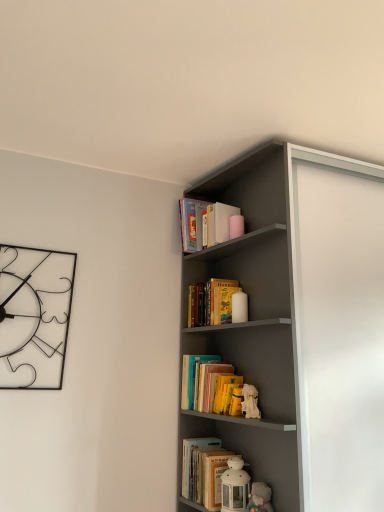
What is the approximate height of matte gray bookshelf at upper right?

Answer: matte gray bookshelf at upper right is 5.50 feet in height.

The width and height of the screenshot is (384, 512). Identify the location of matte gray bookshelf at upper right. 300,325.

Describe the element at coordinates (204, 472) in the screenshot. The height and width of the screenshot is (512, 384). I see `hardcover book at center, arranged as the third book when viewed from the top` at that location.

Where is `white matte lantern at lower center, the second toy when ordered from top to bottom`? Image resolution: width=384 pixels, height=512 pixels. white matte lantern at lower center, the second toy when ordered from top to bottom is located at coordinates (235, 486).

This screenshot has height=512, width=384. Identify the location of white plush toy at middle, which is the 1th toy from top to bottom. (250, 402).

At what (x,y) coordinates should I click in order to perform the action: click on hardcover book at upper center, the 3th book from the bottom. Please return your answer as a coordinate pair (x, y). The height and width of the screenshot is (512, 384). Looking at the image, I should click on (206, 224).

The image size is (384, 512). I want to click on wireframe metal clock at left, so click(x=34, y=316).

From the image's perspective, is yellow paper book at upper center, acting as the 2th book starting from the back, located above or below hardcover book at center, which is the first book in front-to-back order?

Based on their image positions, yellow paper book at upper center, acting as the 2th book starting from the back, is located above hardcover book at center, which is the first book in front-to-back order.

Does yellow paper book at upper center, the 2th book positioned from the front, touch hardcover book at center, the third book positioned from the back?

No, yellow paper book at upper center, the 2th book positioned from the front, is not in contact with hardcover book at center, the third book positioned from the back.

In the scene shown: What's the angular difference between yellow paper book at upper center, acting as the 2th book starting from the back, and hardcover book at center, arranged as the third book when viewed from the top,'s facing directions?

4.68 degrees.

Is yellow paper book at upper center, the 2th book when ordered from top to bottom, oriented towards hardcover book at center, arranged as the third book when viewed from the top?

No, yellow paper book at upper center, the 2th book when ordered from top to bottom, does not turn towards hardcover book at center, arranged as the third book when viewed from the top.

Considering the sizes of wireframe metal clock at left and hardcover book at upper center, marked as the third book in a front-to-back arrangement, in the image, is wireframe metal clock at left bigger or smaller than hardcover book at upper center, marked as the third book in a front-to-back arrangement,?

Clearly, wireframe metal clock at left is larger in size than hardcover book at upper center, marked as the third book in a front-to-back arrangement.

Is wireframe metal clock at left oriented towards hardcover book at upper center, marked as the third book in a front-to-back arrangement?

No.

Are wireframe metal clock at left and hardcover book at upper center, the 3th book from the bottom, located far from each other?

No, wireframe metal clock at left is not far from hardcover book at upper center, the 3th book from the bottom.

Is matte gray bookshelf at upper right closer to the viewer compared to hardcover book at center, arranged as the third book when viewed from the top?

Yes, matte gray bookshelf at upper right is closer to the viewer.

Is matte gray bookshelf at upper right in contact with hardcover book at center, arranged as the third book when viewed from the top?

They are not placed beside each other.

Is hardcover book at center, which is the first book in front-to-back order, surrounded by matte gray bookshelf at upper right?

No, matte gray bookshelf at upper right does not contain hardcover book at center, which is the first book in front-to-back order.

From a real-world perspective, is matte gray bookshelf at upper right positioned under hardcover book at center, which is the first book in front-to-back order, based on gravity?

No, from a real-world perspective, matte gray bookshelf at upper right is not below hardcover book at center, which is the first book in front-to-back order.

The image size is (384, 512). Find the location of `the 1st book behind the wireframe metal clock at left, counting from the anchor's position`. the 1st book behind the wireframe metal clock at left, counting from the anchor's position is located at coordinates [x=210, y=302].

Relative to yellow paper book at upper center, the 2th book when ordered from top to bottom, is wireframe metal clock at left in front or behind?

In the image, wireframe metal clock at left appears in front of yellow paper book at upper center, the 2th book when ordered from top to bottom.

Between point (23, 297) and point (223, 321), which one is positioned behind?

Positioned behind is point (223, 321).

Can you tell me how much white plush toy at middle, which is the 1th toy from top to bottom, and matte gray bookshelf at upper right differ in facing direction?

83.8 degrees separate the facing orientations of white plush toy at middle, which is the 1th toy from top to bottom, and matte gray bookshelf at upper right.

Is white plush toy at middle, arranged as the 2th toy when ordered from the bottom, wider or thinner than matte gray bookshelf at upper right?

Clearly, white plush toy at middle, arranged as the 2th toy when ordered from the bottom, has less width compared to matte gray bookshelf at upper right.

Can you confirm if white plush toy at middle, which is the 1th toy from top to bottom, is taller than matte gray bookshelf at upper right?

No, white plush toy at middle, which is the 1th toy from top to bottom, is not taller than matte gray bookshelf at upper right.

Is white plush toy at middle, which is the 1th toy from top to bottom, to the left or to the right of matte gray bookshelf at upper right in the image?

Based on their positions, white plush toy at middle, which is the 1th toy from top to bottom, is located to the left of matte gray bookshelf at upper right.

From a real-world perspective, is white plush toy at middle, arranged as the 2th toy when ordered from the bottom, below hardcover book at center, the 1th book in the bottom-to-top sequence?

No, from a real-world perspective, white plush toy at middle, arranged as the 2th toy when ordered from the bottom, is not beneath hardcover book at center, the 1th book in the bottom-to-top sequence.

Can we say white plush toy at middle, which is the 1th toy from top to bottom, lies outside hardcover book at center, the 1th book in the bottom-to-top sequence?

Yes, white plush toy at middle, which is the 1th toy from top to bottom, is not within hardcover book at center, the 1th book in the bottom-to-top sequence.

Would you say white plush toy at middle, which is the 1th toy from top to bottom, is to the left or to the right of hardcover book at center, the third book positioned from the back, in the picture?

white plush toy at middle, which is the 1th toy from top to bottom, is to the right of hardcover book at center, the third book positioned from the back.

Is yellow paper book at upper center, which is counted as the 2th book, starting from the bottom, positioned with its back to matte gray bookshelf at upper right?

Yes, yellow paper book at upper center, which is counted as the 2th book, starting from the bottom, is facing away from matte gray bookshelf at upper right.

How far apart are yellow paper book at upper center, the 2th book when ordered from top to bottom, and matte gray bookshelf at upper right?

yellow paper book at upper center, the 2th book when ordered from top to bottom, and matte gray bookshelf at upper right are 14.67 inches apart.

Choose the correct answer: Is yellow paper book at upper center, which is counted as the 2th book, starting from the bottom, inside matte gray bookshelf at upper right or outside it?

yellow paper book at upper center, which is counted as the 2th book, starting from the bottom, cannot be found inside matte gray bookshelf at upper right.

Is yellow paper book at upper center, acting as the 2th book starting from the back, directly adjacent to matte gray bookshelf at upper right?

There is a gap between yellow paper book at upper center, acting as the 2th book starting from the back, and matte gray bookshelf at upper right.

I want to click on the 1st book positioned above the hardcover book at center, the third book positioned from the back (from the image's perspective), so click(x=210, y=302).

In the image, there is a hardcover book at upper center, marked as the third book in a front-to-back arrangement. Identify the location of clock below it (from the image's perspective). The image size is (384, 512). (34, 316).

Considering their positions, is white plush toy at middle, which is the 1th toy from top to bottom, positioned further to hardcover book at center, the third book positioned from the back, than wireframe metal clock at left?

Among the two, wireframe metal clock at left is located further to hardcover book at center, the third book positioned from the back.

Based on their spatial positions, is wireframe metal clock at left or white plush toy at middle, arranged as the 2th toy when ordered from the bottom, further from hardcover book at center, the third book positioned from the back?

wireframe metal clock at left is further to hardcover book at center, the third book positioned from the back.

Which object lies nearer to the anchor point wireframe metal clock at left, hardcover book at center, the third book positioned from the back, or white plush toy at middle, arranged as the 2th toy when ordered from the bottom?

hardcover book at center, the third book positioned from the back, lies closer to wireframe metal clock at left than the other object.

Considering their positions, is white matte lantern at lower center, the second toy when ordered from top to bottom, positioned closer to white plush toy at middle, which is the 1th toy from top to bottom, than yellow paper book at upper center, acting as the 2th book starting from the back?

Based on the image, white matte lantern at lower center, the second toy when ordered from top to bottom, appears to be nearer to white plush toy at middle, which is the 1th toy from top to bottom.

Estimate the real-world distances between objects in this image. Which object is closer to hardcover book at center, the third book positioned from the back, white matte lantern at lower center, placed as the first toy when sorted from bottom to top, or yellow paper book at upper center, acting as the 2th book starting from the back?

Based on the image, white matte lantern at lower center, placed as the first toy when sorted from bottom to top, appears to be nearer to hardcover book at center, the third book positioned from the back.

Which object lies nearer to the anchor point wireframe metal clock at left, white plush toy at middle, which is the 1th toy from top to bottom, or yellow paper book at upper center, the 2th book when ordered from top to bottom?

Based on the image, yellow paper book at upper center, the 2th book when ordered from top to bottom, appears to be nearer to wireframe metal clock at left.

Which object lies further to the anchor point hardcover book at center, arranged as the third book when viewed from the top, white plush toy at middle, which is the 1th toy from top to bottom, or yellow paper book at upper center, which is counted as the 2th book, starting from the bottom?

Based on the image, yellow paper book at upper center, which is counted as the 2th book, starting from the bottom, appears to be further to hardcover book at center, arranged as the third book when viewed from the top.

Considering their positions, is wireframe metal clock at left positioned further to white plush toy at middle, arranged as the 2th toy when ordered from the bottom, than hardcover book at upper center, the 3th book from the bottom?

wireframe metal clock at left is further to white plush toy at middle, arranged as the 2th toy when ordered from the bottom.

Locate an element on the screen. Image resolution: width=384 pixels, height=512 pixels. toy situated between wireframe metal clock at left and white plush toy at middle, which is the 1th toy from top to bottom, from left to right is located at coordinates (235, 486).

This screenshot has width=384, height=512. I want to click on toy between yellow paper book at upper center, which is counted as the 2th book, starting from the bottom, and white matte lantern at lower center, the second toy when ordered from top to bottom, from top to bottom, so click(250, 402).

At what (x,y) coordinates should I click in order to perform the action: click on book between hardcover book at upper center, marked as the 1th book in a top-to-bottom arrangement, and white plush toy at middle, arranged as the 2th toy when ordered from the bottom, from top to bottom. Please return your answer as a coordinate pair (x, y). Image resolution: width=384 pixels, height=512 pixels. Looking at the image, I should click on (210, 302).

In order to click on shelf between hardcover book at upper center, marked as the 1th book in a top-to-bottom arrangement, and white matte lantern at lower center, the second toy when ordered from top to bottom, in the up-down direction in this screenshot , I will do `click(300, 325)`.